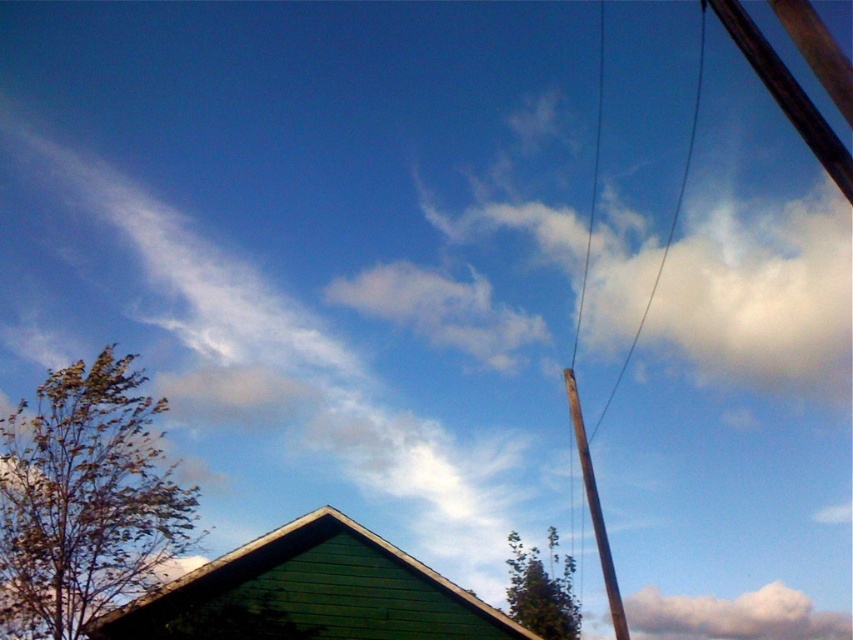
Question: Is green leafy tree at lower center smaller than smooth wire at upper right?

Choices:
 (A) no
 (B) yes

Answer: (B)

Question: Among these objects, which one is farthest from the camera?

Choices:
 (A) brown wire at upper right
 (B) green leafy tree at lower center
 (C) brown leafy tree at lower left
 (D) brown wooden telegraph pole at right

Answer: (A)

Question: Does brown wooden telegraph pole at right lie behind smooth wire at upper right?

Choices:
 (A) yes
 (B) no

Answer: (B)

Question: Is white fluffy cloud at upper center to the left of green leafy tree at lower center from the viewer's perspective?

Choices:
 (A) yes
 (B) no

Answer: (B)

Question: Estimate the real-world distances between objects in this image. Which object is closer to the green leafy tree at lower center?

Choices:
 (A) smooth wire at upper right
 (B) brown wooden telegraph pole at right

Answer: (B)

Question: Which object is positioned farthest from the brown wire at upper right?

Choices:
 (A) white fluffy cloud at upper center
 (B) brown wooden telegraph pole at right

Answer: (B)